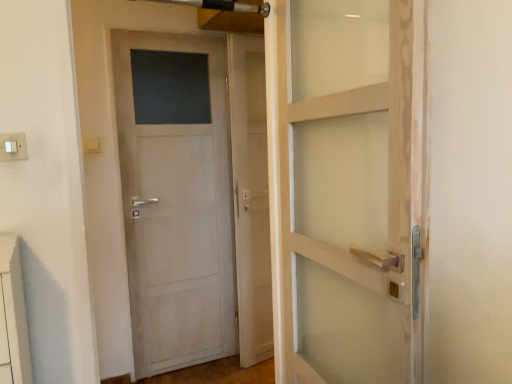
Question: Are white plastic switch at upper left and white wood door at left located far from each other?

Choices:
 (A) no
 (B) yes

Answer: (B)

Question: From the image's perspective, is white plastic switch at upper left under white wood door at left?

Choices:
 (A) no
 (B) yes

Answer: (A)

Question: Considering the relative sizes of white plastic switch at upper left and white wood door at left in the image provided, is white plastic switch at upper left thinner than white wood door at left?

Choices:
 (A) no
 (B) yes

Answer: (B)

Question: Does white plastic switch at upper left have a larger size compared to white wood door at left?

Choices:
 (A) no
 (B) yes

Answer: (A)

Question: Does white plastic switch at upper left appear on the right side of white wood door at left?

Choices:
 (A) no
 (B) yes

Answer: (A)

Question: Is white plastic switch at upper left outside of white wood door at left?

Choices:
 (A) no
 (B) yes

Answer: (B)

Question: Does white plastic switch at upper left lie behind transparent glass screen door at center?

Choices:
 (A) no
 (B) yes

Answer: (A)

Question: Does white plastic switch at upper left lie in front of transparent glass screen door at center?

Choices:
 (A) yes
 (B) no

Answer: (A)

Question: Does white plastic switch at upper left have a lesser width compared to transparent glass screen door at center?

Choices:
 (A) no
 (B) yes

Answer: (B)

Question: Is transparent glass screen door at center at the back of white plastic switch at upper left?

Choices:
 (A) no
 (B) yes

Answer: (A)

Question: From a real-world perspective, is white plastic switch at upper left located beneath transparent glass screen door at center?

Choices:
 (A) yes
 (B) no

Answer: (B)

Question: Is white plastic switch at upper left oriented towards transparent glass screen door at center?

Choices:
 (A) yes
 (B) no

Answer: (B)

Question: Is transparent glass screen door at center oriented away from white plastic switch at upper left?

Choices:
 (A) yes
 (B) no

Answer: (B)